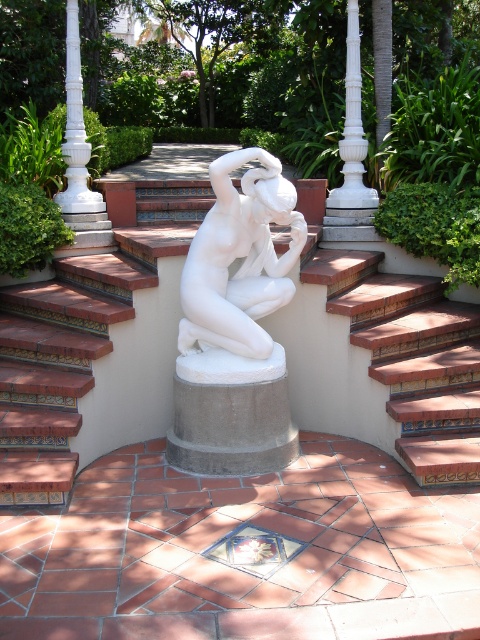
From the picture: Measure the distance between point (x=257, y=353) and camera.

Point (x=257, y=353) is 3.69 meters from camera.

Who is positioned more to the right, white marble statue at center or white marble pillar at center?

white marble statue at center is more to the right.

Is point (294, 234) positioned behind point (80, 243)?

No, (294, 234) is in front of (80, 243).

I want to click on white marble statue at center, so click(x=240, y=257).

Does terracotta tile stairs at center appear over white marble pillar at center?

Incorrect, terracotta tile stairs at center is not positioned above white marble pillar at center.

Is terracotta tile stairs at center positioned before white marble pillar at center?

Yes, terracotta tile stairs at center is closer to the viewer.

Which is behind, point (389, 280) or point (61, 252)?

Positioned behind is point (61, 252).

Where is `terracotta tile stairs at center`? This screenshot has width=480, height=640. terracotta tile stairs at center is located at coordinates (411, 356).

Is terracotta tile stairs at center positioned at the back of white marble pillar at upper center?

No, terracotta tile stairs at center is closer to the viewer.

Is terracotta tile stairs at center positioned before white marble pillar at upper center?

That is True.

Measure the distance between terracotta tile stairs at center and camera.

terracotta tile stairs at center and camera are 3.48 meters apart from each other.

Identify the location of terracotta tile stairs at center. This screenshot has height=640, width=480. (411, 356).